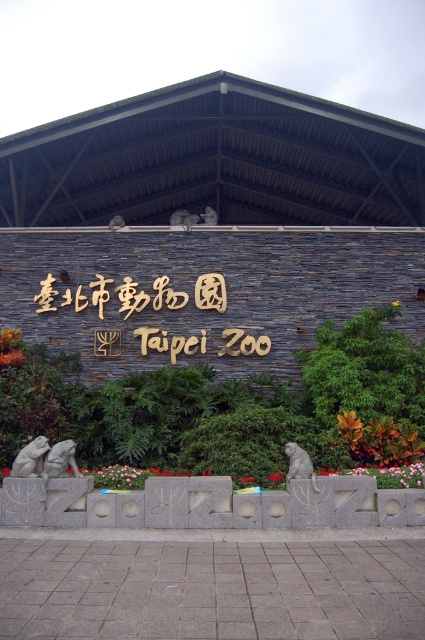
You are standing at the entrance of Taipei Zoo and want to take a photo of the gray stone elephant at lower left. Which direction should you walk to get closer to it?

The gray stone elephant at lower left is located at point (59, 460), so you should walk towards the lower left direction to get closer to it.

You are standing at the entrance of Taipei Zoo and want to read the black wood sign at center. However, there is a stone statue at center blocking your view. Can you see the sign by moving to the right side of the statue?

The black wood sign at center is to the left of the stone statue at center. Therefore, moving to the right side of the stone statue at center would allow you to see the sign as it is positioned to the left of the statue.

You are standing at the entrance of Taipei Zoo and looking at the stone wall with golden characters. There are two points marked on the wall at coordinates point (42,461) and point (309,467). Which point is closer to your eyes?

Point (42,461) is further to the camera than point (309,467), so the point closer to your eyes is point (309,467).